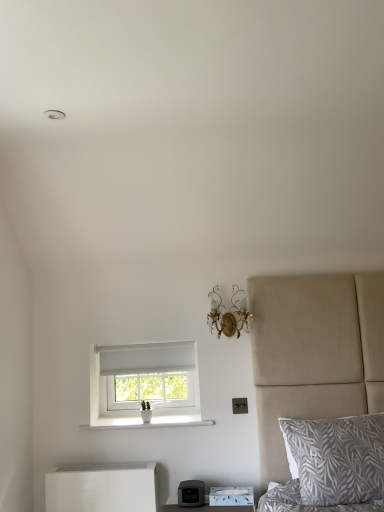
The width and height of the screenshot is (384, 512). I want to click on white ceramic vase at lower center, so click(148, 423).

This screenshot has width=384, height=512. Identify the location of white ceramic vase at lower center. (148, 423).

In the scene shown: Can you confirm if white ceramic vase at lower center is smaller than white fabric window at center?

Yes.

In the scene shown: Is white ceramic vase at lower center aimed at white fabric window at center?

Yes, white ceramic vase at lower center is facing white fabric window at center.

From the image's perspective, which object appears higher, white ceramic vase at lower center or white fabric window at center?

white fabric window at center appears higher in the image.

Can you confirm if white ceramic vase at lower center is taller than white fabric window at center?

No.

From a real-world perspective, is matte black printer at lower center positioned under white matte nightstand at lower left based on gravity?

No, from a real-world perspective, matte black printer at lower center is not beneath white matte nightstand at lower left.

Based on their sizes in the image, would you say matte black printer at lower center is bigger or smaller than white matte nightstand at lower left?

In the image, matte black printer at lower center appears to be smaller than white matte nightstand at lower left.

Which of these two, matte black printer at lower center or gold crystal sconce at upper center, stands shorter?

With less height is matte black printer at lower center.

In the image, there is a matte black printer at lower center. Where is `light fixture above it (from the image's perspective)`? The width and height of the screenshot is (384, 512). light fixture above it (from the image's perspective) is located at coordinates (228, 313).

Looking at this image, in terms of width, does matte black printer at lower center look wider or thinner when compared to gold crystal sconce at upper center?

In the image, matte black printer at lower center appears to be more narrow than gold crystal sconce at upper center.

From a real-world perspective, does white matte nightstand at lower left sit lower than gray leaf-patterned pillow at lower right?

Indeed, from a real-world perspective, white matte nightstand at lower left is positioned beneath gray leaf-patterned pillow at lower right.

Measure the distance from white matte nightstand at lower left to gray leaf-patterned pillow at lower right.

white matte nightstand at lower left is 3.31 feet from gray leaf-patterned pillow at lower right.

Where is `pillow in front of the white matte nightstand at lower left`? This screenshot has height=512, width=384. pillow in front of the white matte nightstand at lower left is located at coordinates (337, 458).

From the image's perspective, which one is positioned higher, white matte nightstand at lower left or gray leaf-patterned pillow at lower right?

gray leaf-patterned pillow at lower right, from the image's perspective.

Is the surface of gold crystal sconce at upper center in direct contact with matte black printer at lower center?

No, gold crystal sconce at upper center is not touching matte black printer at lower center.

You are a GUI agent. You are given a task and a screenshot of the screen. Output one action in this format:
    pyautogui.click(x=<x>, y=<y>)
    Task: Click on the appliance that is under the gold crystal sconce at upper center (from a real-world perspective)
    The image size is (384, 512).
    Given the screenshot: What is the action you would take?
    tap(191, 493)

Considering the relative positions of gold crystal sconce at upper center and matte black printer at lower center in the image provided, is gold crystal sconce at upper center to the left or to the right of matte black printer at lower center?

Clearly, gold crystal sconce at upper center is on the right of matte black printer at lower center in the image.

Looking at this image, is white fabric window at center far from gray leaf-patterned pillow at lower right?

They are positioned close to each other.

Is white fabric window at center in front of or behind gray leaf-patterned pillow at lower right in the image?

white fabric window at center is positioned farther from the viewer than gray leaf-patterned pillow at lower right.

From the image's perspective, between white fabric window at center and gray leaf-patterned pillow at lower right, who is located below?

gray leaf-patterned pillow at lower right, from the image's perspective.

Is white fabric window at center not within gray leaf-patterned pillow at lower right?

white fabric window at center lies outside gray leaf-patterned pillow at lower right's area.

Is white matte nightstand at lower left positioned far away from gold crystal sconce at upper center?

Yes.

Which of these two, white matte nightstand at lower left or gold crystal sconce at upper center, is smaller?

With smaller size is gold crystal sconce at upper center.

Is white matte nightstand at lower left wider or thinner than gold crystal sconce at upper center?

In the image, white matte nightstand at lower left appears to be more narrow than gold crystal sconce at upper center.

In the scene shown: From the image's perspective, would you say white matte nightstand at lower left is shown under gold crystal sconce at upper center?

Yes.

This screenshot has width=384, height=512. I want to click on window above the white ceramic vase at lower center (from a real-world perspective), so click(144, 385).

This screenshot has width=384, height=512. What are the coordinates of `appliance on the right side of white matte nightstand at lower left` in the screenshot? It's located at (191, 493).

Estimate the real-world distances between objects in this image. Which object is closer to gray leaf-patterned pillow at lower right, white matte nightstand at lower left or matte black printer at lower center?

matte black printer at lower center lies closer to gray leaf-patterned pillow at lower right than the other object.

When comparing their distances from white matte nightstand at lower left, does gray leaf-patterned pillow at lower right or white fabric window at center seem closer?

white fabric window at center lies closer to white matte nightstand at lower left than the other object.

Which object lies further to the anchor point matte black printer at lower center, white fabric window at center or white ceramic vase at lower center?

white fabric window at center is further to matte black printer at lower center.

When comparing their distances from white matte nightstand at lower left, does gray leaf-patterned pillow at lower right or matte black printer at lower center seem further?

Among the two, gray leaf-patterned pillow at lower right is located further to white matte nightstand at lower left.

Which object lies nearer to the anchor point white fabric window at center, matte black printer at lower center or white ceramic vase at lower center?

→ Based on the image, white ceramic vase at lower center appears to be nearer to white fabric window at center.

Looking at the image, which one is located closer to white ceramic vase at lower center, gold crystal sconce at upper center or gray leaf-patterned pillow at lower right?

Based on the image, gold crystal sconce at upper center appears to be nearer to white ceramic vase at lower center.

In the scene shown: Considering their positions, is matte black printer at lower center positioned closer to gold crystal sconce at upper center than white matte nightstand at lower left?

matte black printer at lower center lies closer to gold crystal sconce at upper center than the other object.

Which object lies nearer to the anchor point white ceramic vase at lower center, gold crystal sconce at upper center or white fabric window at center?

Among the two, white fabric window at center is located nearer to white ceramic vase at lower center.

Identify the location of appliance between gold crystal sconce at upper center and white matte nightstand at lower left in the vertical direction. (191, 493).

The width and height of the screenshot is (384, 512). I want to click on appliance between white fabric window at center and gray leaf-patterned pillow at lower right, so click(x=191, y=493).

You are a GUI agent. You are given a task and a screenshot of the screen. Output one action in this format:
    pyautogui.click(x=<x>, y=<y>)
    Task: Click on the window sill between white fabric window at center and gray leaf-patterned pillow at lower right in the horizontal direction
    This screenshot has width=384, height=512.
    Given the screenshot: What is the action you would take?
    pyautogui.click(x=148, y=423)

At what (x,y) coordinates should I click in order to perform the action: click on light fixture between white ceramic vase at lower center and gray leaf-patterned pillow at lower right from left to right. Please return your answer as a coordinate pair (x, y). Image resolution: width=384 pixels, height=512 pixels. Looking at the image, I should click on (228, 313).